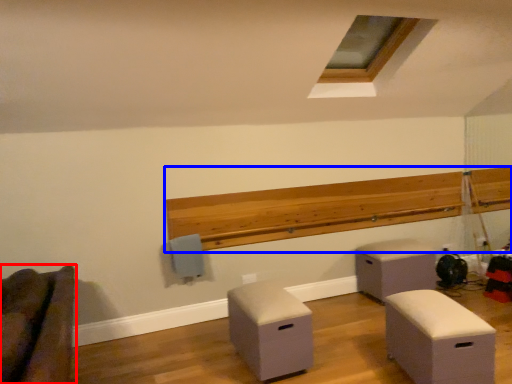
Question: Which object is further to the camera taking this photo, furniture (highlighted by a red box) or ledge (highlighted by a blue box)?

Choices:
 (A) furniture
 (B) ledge

Answer: (B)